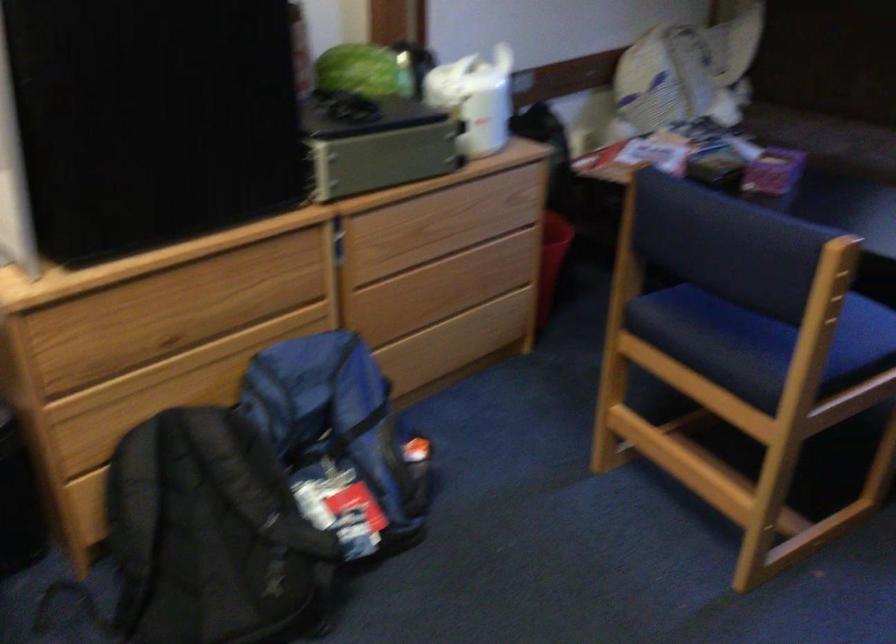
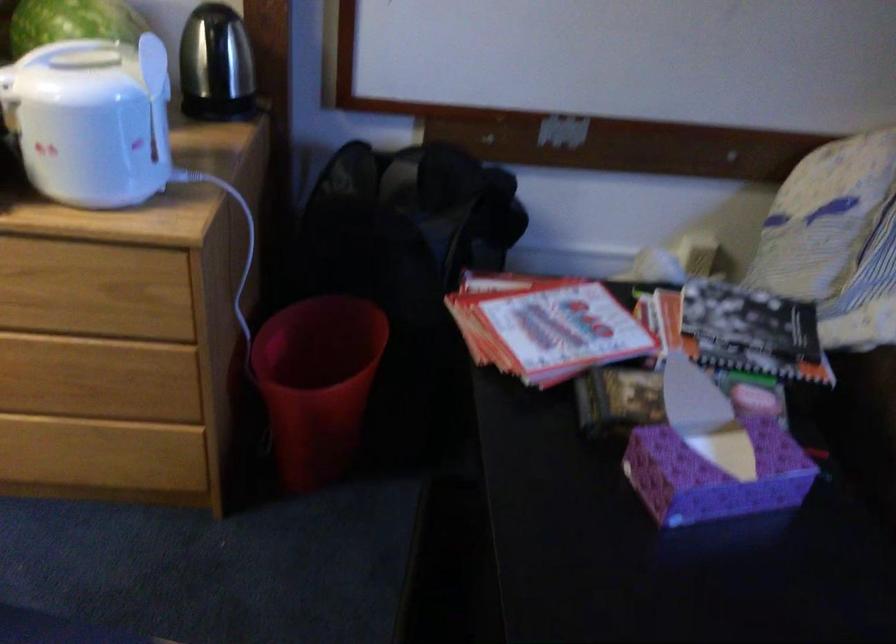
In the second image, find the point that corresponds to point (643, 152) in the first image.

(545, 326)